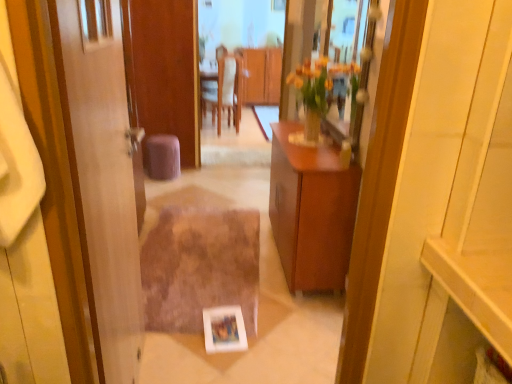
Locate an element on the screen. Image resolution: width=512 pixels, height=384 pixels. free space between brown shaggy rug at center and wooden cabinet at center, placed as the 2th cabinetry when sorted from back to front is located at coordinates (274, 288).